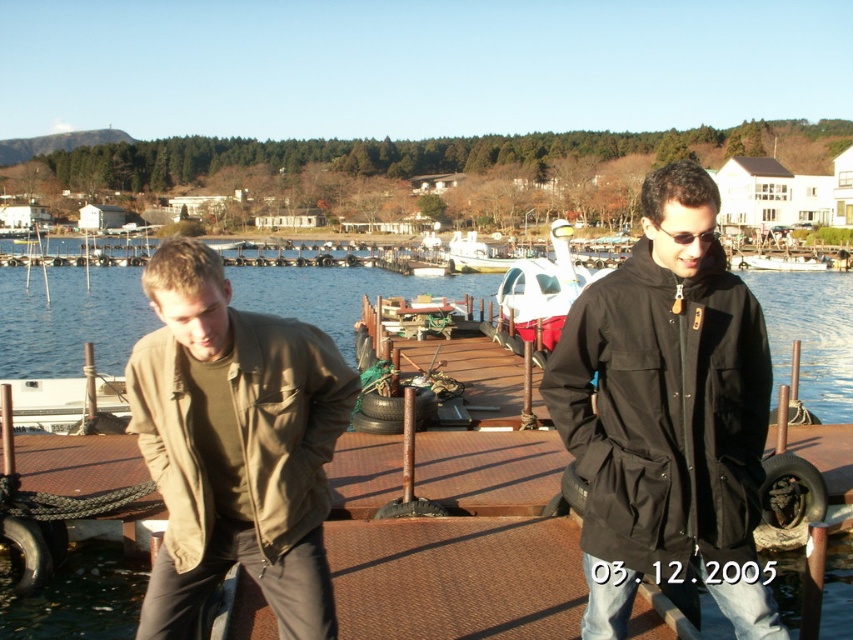
Question: Can you confirm if black cotton jacket at center is positioned above white glossy pod at center?

Choices:
 (A) no
 (B) yes

Answer: (A)

Question: Which object is farther from the camera taking this photo?

Choices:
 (A) olive green fabric jacket at lower left
 (B) white glossy pod at center
 (C) blue water at center

Answer: (B)

Question: Which is farther from the black cotton jacket at center?

Choices:
 (A) olive green fabric jacket at lower left
 (B) white glossy pod at center
 (C) blue water at center

Answer: (C)

Question: Which is nearer to the olive green fabric jacket at lower left?

Choices:
 (A) blue water at center
 (B) black cotton jacket at center

Answer: (B)

Question: In this image, where is black cotton jacket at center located relative to white glossy pod at center?

Choices:
 (A) left
 (B) right

Answer: (A)

Question: Can you confirm if black cotton jacket at center is bigger than white glossy pod at center?

Choices:
 (A) yes
 (B) no

Answer: (B)